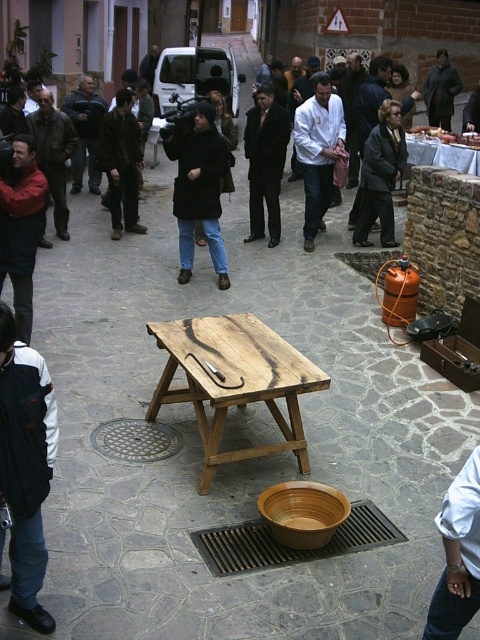
You are a delivery person who needs to place a package on the ground between the black fuzzy coat at center and the brown matte bowl at center. Can you fit the package there?

The black fuzzy coat at center is located above the brown matte bowl at center, so there is no space between them on the ground. The package cannot be placed there.

You are standing at the point marked by the coordinates point (233, 381). Looking around, you see a wooden picnic table at center and a large orange gas cylinder to the right of the table. Which object is closer to your current position?

The wooden picnic table at center is closer to your current position because the point marks its location.